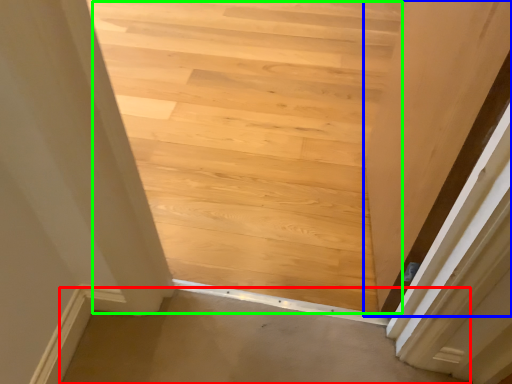
Question: Which object is positioned farthest from plain (highlighted by a red box)? Select from door (highlighted by a blue box) and stairwell (highlighted by a green box).

Choices:
 (A) door
 (B) stairwell

Answer: (B)